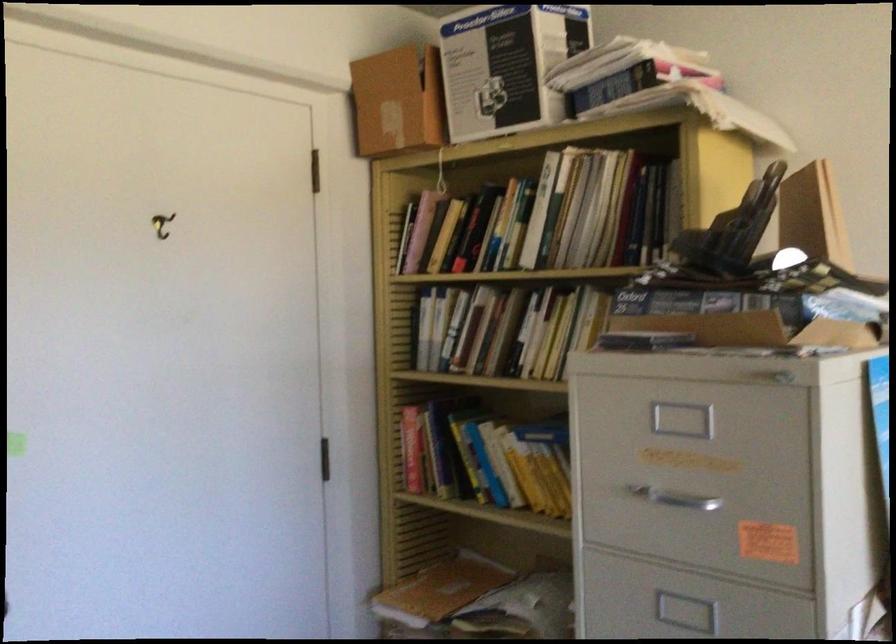
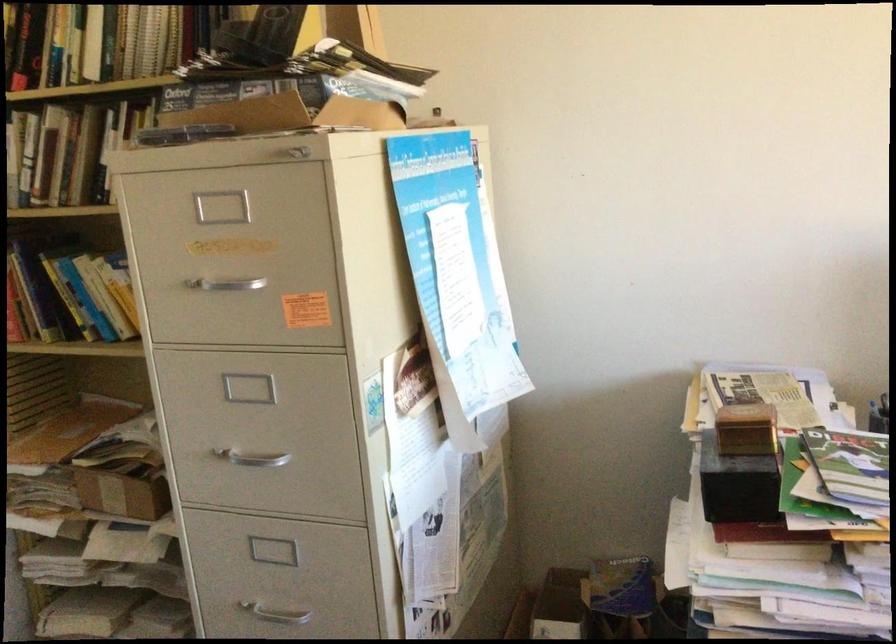
Where in the second image is the point corresponding to [670,496] from the first image?

(224, 283)